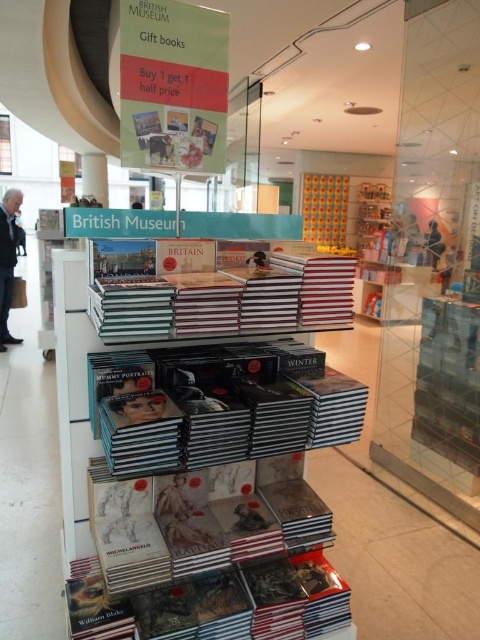
Question: Among these objects, which one is nearest to the camera?

Choices:
 (A) hardcover book at center
 (B) matte black book at center
 (C) white matte book at center

Answer: (A)

Question: Which point is closer to the camera taking this photo?

Choices:
 (A) (81, 269)
 (B) (206, 333)

Answer: (B)

Question: Can you confirm if white matte book at center is smaller than hardcover book at center?

Choices:
 (A) yes
 (B) no

Answer: (B)

Question: Is white matte book at center positioned behind hardcover book at center?

Choices:
 (A) yes
 (B) no

Answer: (A)

Question: Which point is closer to the camera?

Choices:
 (A) white matte book at center
 (B) matte black book at center
 (C) hardcover book at center

Answer: (C)

Question: Does white matte book at center come behind matte black book at center?

Choices:
 (A) yes
 (B) no

Answer: (B)